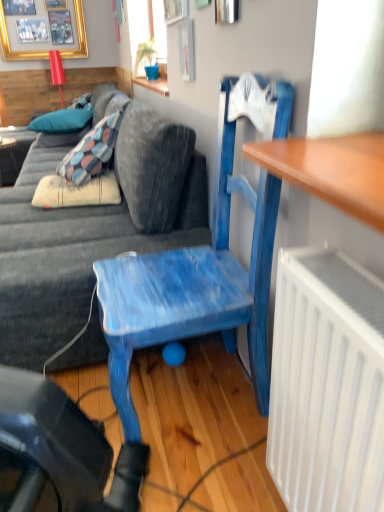
Where is `blue fabric pillow at upper left, which is counted as the second pillow, starting from the bottom`? blue fabric pillow at upper left, which is counted as the second pillow, starting from the bottom is located at coordinates (63, 120).

This screenshot has width=384, height=512. What are the coordinates of `gold framed picture at upper left` in the screenshot? It's located at (10, 46).

Locate an element on the screen. The image size is (384, 512). blue painted wood chair at center is located at coordinates (202, 263).

Measure the distance between blue painted wood chair at center and camera.

blue painted wood chair at center and camera are 37.21 inches apart from each other.

The width and height of the screenshot is (384, 512). What do you see at coordinates (9, 147) in the screenshot?
I see `matte black desk at left` at bounding box center [9, 147].

The image size is (384, 512). I want to click on velvet blue couch at center, so click(x=93, y=227).

Would you say matte black desk at left is inside or outside velvet blue couch at center?

matte black desk at left is outside velvet blue couch at center.

Between matte black desk at left and velvet blue couch at center, which one has larger width?

With larger width is velvet blue couch at center.

Is matte black desk at left facing away from velvet blue couch at center?

No.

In order to click on studio couch located on the right of matte black desk at left in this screenshot , I will do `click(93, 227)`.

Considering the points (82, 12) and (122, 425), which point is behind, point (82, 12) or point (122, 425)?

The point (82, 12) is farther.

Which of these two, gold framed picture at upper left or blue painted wood chair at center, is smaller?

Smaller between the two is gold framed picture at upper left.

Between gold framed picture at upper left and blue painted wood chair at center, which one appears on the left side from the viewer's perspective?

From the viewer's perspective, gold framed picture at upper left appears more on the left side.

From the image's perspective, relative to matte black desk at left, is gold framed picture at upper left above or below?

Clearly, from the image's perspective, gold framed picture at upper left is above matte black desk at left.

From a real-world perspective, who is located higher, gold framed picture at upper left or matte black desk at left?

gold framed picture at upper left is physically above.

Between gold framed picture at upper left and matte black desk at left, which one appears on the right side from the viewer's perspective?

Positioned to the right is matte black desk at left.

Identify the location of chair in front of the blue fabric pillow at upper left, which ranks as the second pillow in top-to-bottom order. (202, 263).

Are blue painted wood chair at center and blue fabric pillow at upper left, the first pillow from the bottom, making contact?

blue painted wood chair at center and blue fabric pillow at upper left, the first pillow from the bottom, are not in contact.

Considering the positions of objects blue painted wood chair at center and blue fabric pillow at upper left, the first pillow from the bottom, in the image provided, who is more to the right, blue painted wood chair at center or blue fabric pillow at upper left, the first pillow from the bottom,?

From the viewer's perspective, blue painted wood chair at center appears more on the right side.

Is blue painted wood chair at center far away from blue fabric pillow at upper left, which is counted as the second pillow, starting from the bottom?

That's right, there is a large distance between blue painted wood chair at center and blue fabric pillow at upper left, which is counted as the second pillow, starting from the bottom.

Which of these two, blue painted wood chair at center or blue fabric pillow at upper left, the first pillow from the top, stands shorter?

Standing shorter between the two is blue fabric pillow at upper left, the first pillow from the top.

Which is closer to the camera, (268, 134) or (68, 114)?

Point (268, 134).

How different are the orientations of blue painted wood chair at center and blue fabric pillow at upper left, the first pillow from the top, in degrees?

71.4 degrees separate the facing orientations of blue painted wood chair at center and blue fabric pillow at upper left, the first pillow from the top.

From a real-world perspective, is gold framed picture at upper left over velvet blue couch at center?

Yes, from a real-world perspective, gold framed picture at upper left is on top of velvet blue couch at center.

Which of these two, gold framed picture at upper left or velvet blue couch at center, is smaller?

With smaller size is gold framed picture at upper left.

At what (x,y) coordinates should I click in order to perform the action: click on picture frame located on the left of velvet blue couch at center. Please return your answer as a coordinate pair (x, y). The image size is (384, 512). Looking at the image, I should click on (10, 46).

Is gold framed picture at upper left to the left of velvet blue couch at center from the viewer's perspective?

Yes.

From the image's perspective, which object appears higher, blue fabric pillow at upper left, the first pillow from the top, or matte black desk at left?

blue fabric pillow at upper left, the first pillow from the top, is shown above in the image.

Which of these two, blue fabric pillow at upper left, the first pillow from the top, or matte black desk at left, is thinner?

matte black desk at left.

Based on the photo, is blue fabric pillow at upper left, which is counted as the second pillow, starting from the bottom, shorter than matte black desk at left?

Indeed, blue fabric pillow at upper left, which is counted as the second pillow, starting from the bottom, has a lesser height compared to matte black desk at left.

From a real-world perspective, who is located higher, blue fabric pillow at upper left, the first pillow from the top, or matte black desk at left?

blue fabric pillow at upper left, the first pillow from the top, from a real-world perspective.

I want to click on desk on the left of velvet blue couch at center, so click(9, 147).

Identify the location of picture frame behind the blue painted wood chair at center. This screenshot has width=384, height=512. (10, 46).

Based on their spatial positions, is gold framed picture at upper left or blue fabric pillow at upper left, which ranks as the second pillow in top-to-bottom order, closer to velvet blue couch at center?

blue fabric pillow at upper left, which ranks as the second pillow in top-to-bottom order, is closer to velvet blue couch at center.

Estimate the real-world distances between objects in this image. Which object is further from blue fabric pillow at upper left, the first pillow from the bottom, matte black desk at left or blue fabric pillow at upper left, the first pillow from the top?

matte black desk at left is further to blue fabric pillow at upper left, the first pillow from the bottom.

From the image, which object appears to be farther from blue fabric pillow at upper left, which ranks as the second pillow in top-to-bottom order, blue fabric pillow at upper left, the first pillow from the top, or velvet blue couch at center?

Among the two, velvet blue couch at center is located further to blue fabric pillow at upper left, which ranks as the second pillow in top-to-bottom order.

Based on their spatial positions, is blue fabric pillow at upper left, the first pillow from the bottom, or gold framed picture at upper left further from blue painted wood chair at center?

The object further to blue painted wood chair at center is gold framed picture at upper left.

From the image, which object appears to be nearer to gold framed picture at upper left, matte black desk at left or velvet blue couch at center?

matte black desk at left lies closer to gold framed picture at upper left than the other object.

Looking at the image, which one is located closer to blue fabric pillow at upper left, which is counted as the second pillow, starting from the bottom, gold framed picture at upper left or velvet blue couch at center?

velvet blue couch at center is closer to blue fabric pillow at upper left, which is counted as the second pillow, starting from the bottom.

Estimate the real-world distances between objects in this image. Which object is closer to velvet blue couch at center, blue painted wood chair at center or blue fabric pillow at upper left, the first pillow from the bottom?

blue painted wood chair at center.

When comparing their distances from blue fabric pillow at upper left, which is counted as the second pillow, starting from the bottom, does blue painted wood chair at center or gold framed picture at upper left seem closer?

Among the two, gold framed picture at upper left is located nearer to blue fabric pillow at upper left, which is counted as the second pillow, starting from the bottom.

In order to click on pillow between velvet blue couch at center and blue fabric pillow at upper left, the first pillow from the bottom, from front to back in this screenshot , I will do `click(63, 120)`.

Identify the location of pillow situated between matte black desk at left and blue fabric pillow at upper left, the first pillow from the bottom, from left to right. (63, 120).

What are the coordinates of `pillow between blue painted wood chair at center and blue fabric pillow at upper left, the first pillow from the bottom, from front to back` in the screenshot? It's located at (63, 120).

Identify the location of studio couch between blue painted wood chair at center and blue fabric pillow at upper left, the first pillow from the bottom, in the front-back direction. This screenshot has width=384, height=512. (93, 227).